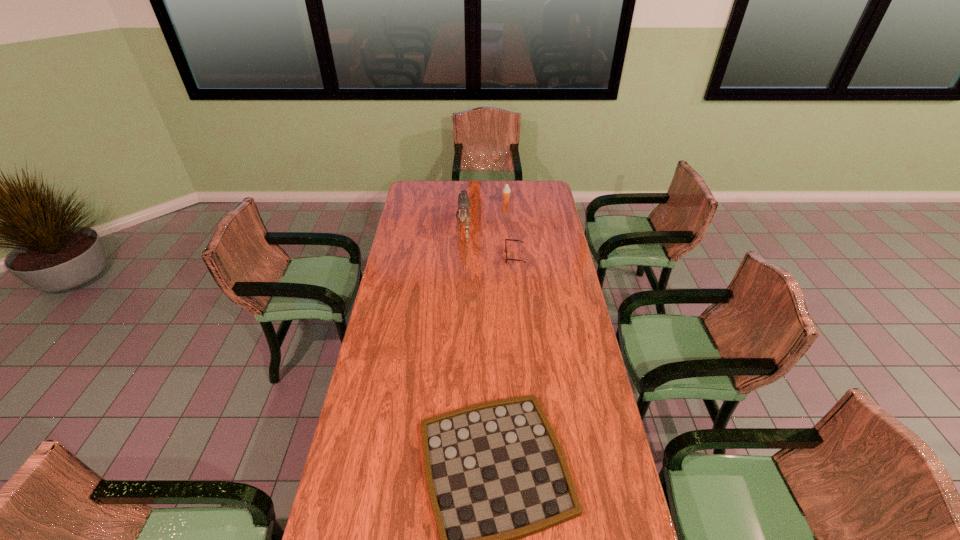
This screenshot has height=540, width=960. Find the location of `the tallest object`. the tallest object is located at coordinates tap(462, 214).

Locate an element on the screen. icecream is located at coordinates (506, 192).

Where is `the third tallest object`? This screenshot has height=540, width=960. the third tallest object is located at coordinates (505, 239).

The height and width of the screenshot is (540, 960). I want to click on sunglasses, so click(505, 239).

Where is `free region located on the face of the cat`? The width and height of the screenshot is (960, 540). free region located on the face of the cat is located at coordinates (461, 282).

Where is `free region located on the left of the second tallest object`? The width and height of the screenshot is (960, 540). free region located on the left of the second tallest object is located at coordinates (437, 201).

Identify the location of free space located 0.380m on the front-facing side of the sunglasses. (427, 256).

The width and height of the screenshot is (960, 540). I want to click on vacant space located on the front-facing side of the sunglasses, so click(452, 256).

Identify the location of vacant space located 0.140m on the front-facing side of the sunglasses. (477, 256).

Where is `object that is at the far edge`? The height and width of the screenshot is (540, 960). object that is at the far edge is located at coordinates (506, 192).